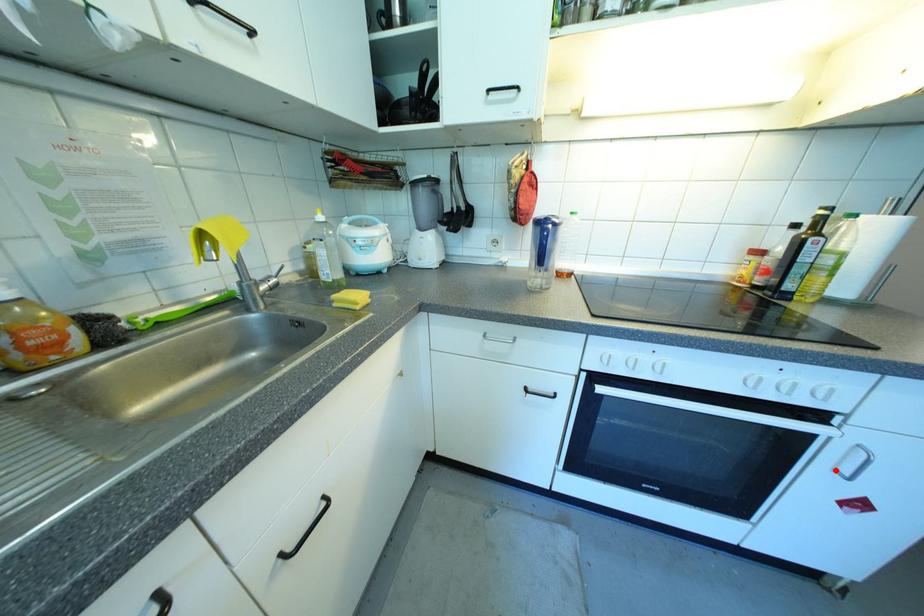
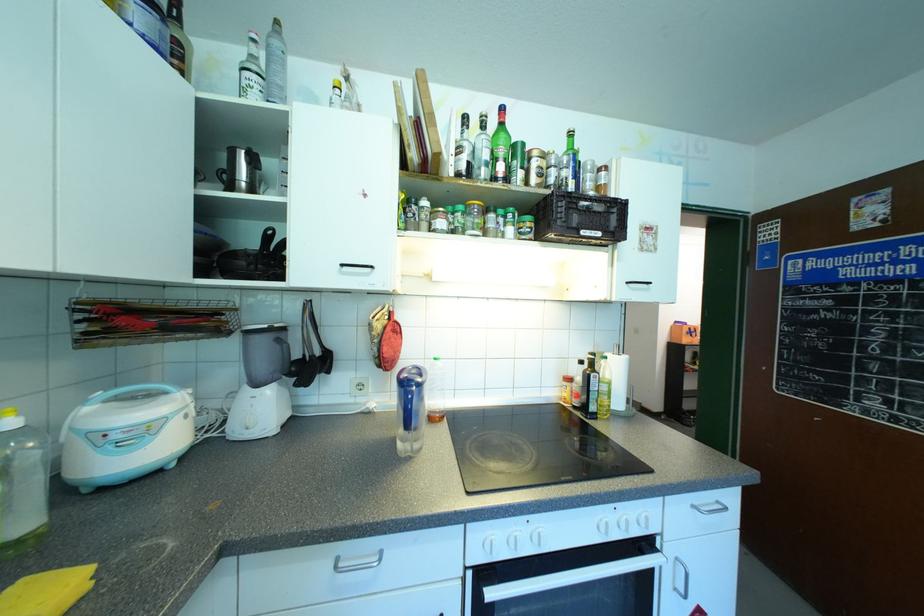
Where in the second image is the point corresponding to the highlighted location from the first image?

(675, 589)